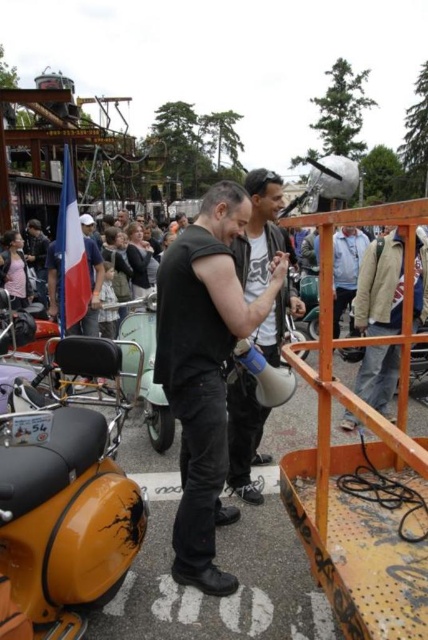
You are a photographer at the event and want to capture a photo of the light gray jacket at center without the matte black megaphone at center blocking it. Is this possible based on their positions?

The matte black megaphone at center is in front of the light gray jacket at center, so it is blocking the view. To capture the light gray jacket at center without the megaphone blocking it, you would need to reposition yourself or the subjects so that the light gray jacket at center is no longer behind the matte black megaphone at center.